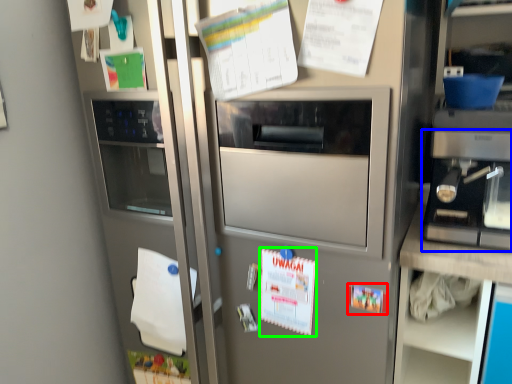
Question: Estimate the real-world distances between objects in this image. Which object is closer to poster (highlighted by a red box), appliance (highlighted by a blue box) or poster (highlighted by a green box)?

Choices:
 (A) appliance
 (B) poster

Answer: (B)